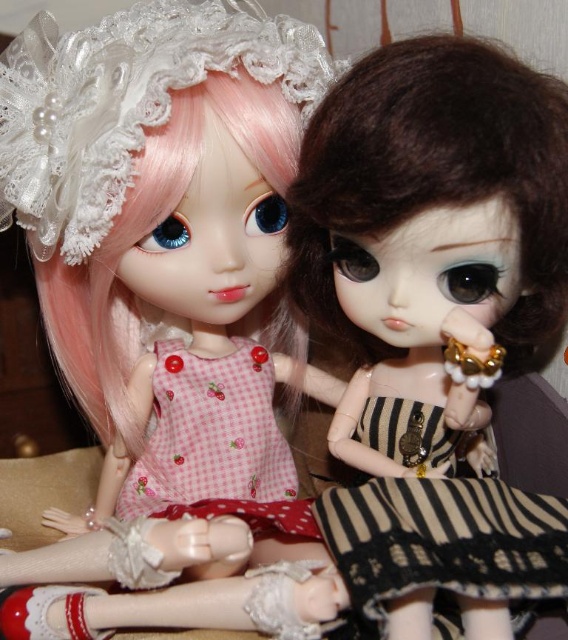
You are a tailor trying to decide which fabric to use for a new dress design. You have the black striped fabric at center and the pink checkered fabric dress at center. Which fabric has a greater width?

The black striped fabric at center has a greater width than the pink checkered fabric dress at center according to the description.

You are standing in front of the dolls and want to place a small gift exactly at the point labeled point [448,538]. If your hand can reach up to 20 inches, will you be able to place the gift there?

The distance of point [448,538] from viewer is 22.49 inches, so your hand can only reach up to 20 inches, meaning you won t be able to place the gift there.

You are a toy organizer trying to arrange these dolls and their accessories. You need to place the matte black doll at center and the pink checkered fabric dress at center into a display case. If the case has a height limit of 30 cm, and the dress is 20 cm tall, will the doll fit in the case without exceeding the height limit?

The matte black doll at center is bigger than the pink checkered fabric dress at center, which is 20 cm tall. Since the doll is larger than the dress, its height would exceed the 30 cm limit. Therefore, the doll cannot be placed in the case without exceeding the height limit.